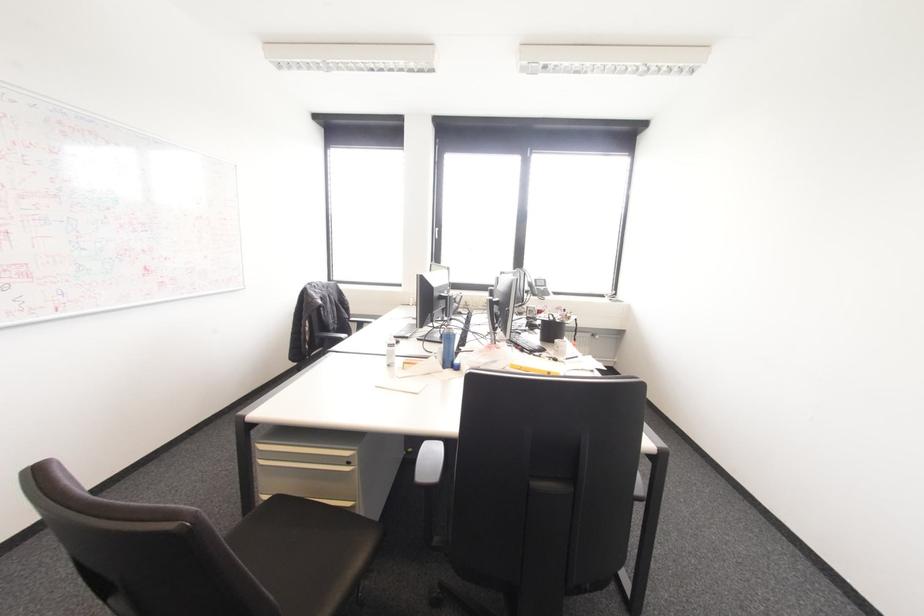
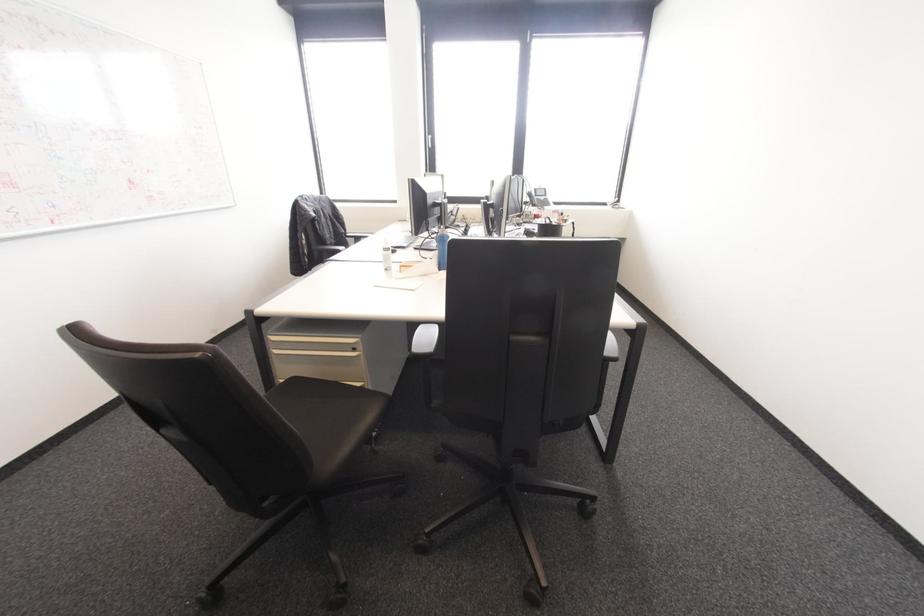
Find the pixel in the second image that matches pixel 275 498 in the first image.

(294, 379)